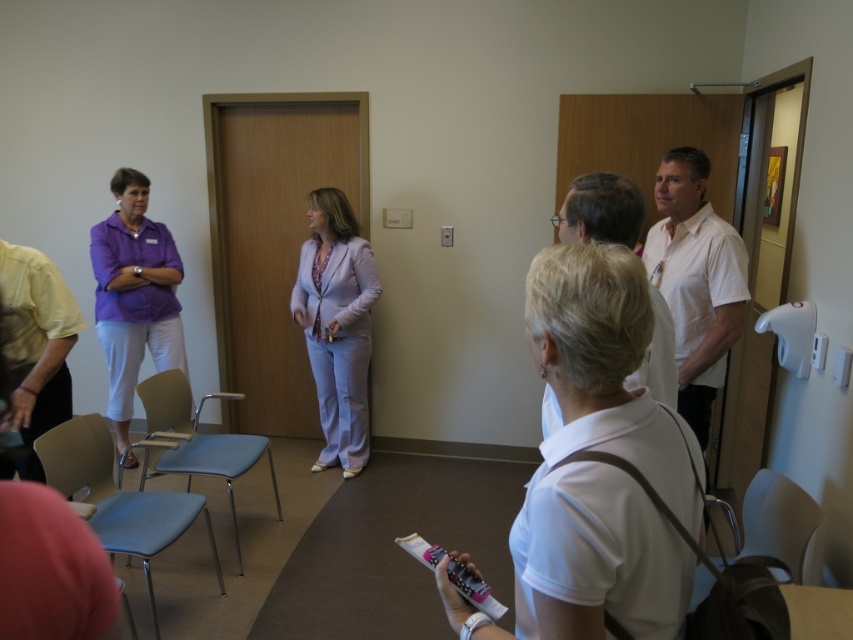
Question: Does white matte shirt at center appear over white plastic chair at lower right?

Choices:
 (A) yes
 (B) no

Answer: (A)

Question: Which object appears farthest from the camera in this image?

Choices:
 (A) white plastic chair at lower right
 (B) lavender fabric suit at center
 (C) light blue fabric chair at center
 (D) light blue plastic chair at lower left

Answer: (B)

Question: Which of these objects is positioned closest to the white plastic chair at lower right?

Choices:
 (A) purple matte shirt at left
 (B) light blue fabric chair at center
 (C) wooden elevator at center

Answer: (B)

Question: Which object is the closest to the lavender fabric suit at center?

Choices:
 (A) wooden elevator at center
 (B) white plastic chair at lower right
 (C) light blue fabric chair at center

Answer: (A)

Question: Is wooden elevator at center bigger than lavender fabric suit at center?

Choices:
 (A) no
 (B) yes

Answer: (B)

Question: Does wooden elevator at center have a greater width compared to purple matte shirt at left?

Choices:
 (A) yes
 (B) no

Answer: (A)